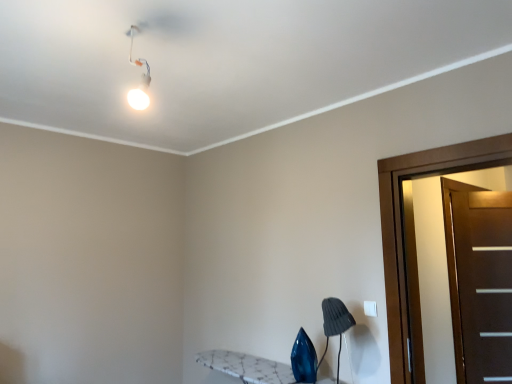
Question: Can you confirm if white glossy light fixture at upper left is wider than gray fabric lampshade at lower right?

Choices:
 (A) yes
 (B) no

Answer: (B)

Question: Can you confirm if white glossy light fixture at upper left is taller than gray fabric lampshade at lower right?

Choices:
 (A) yes
 (B) no

Answer: (B)

Question: Is white glossy light fixture at upper left turned away from gray fabric lampshade at lower right?

Choices:
 (A) no
 (B) yes

Answer: (A)

Question: Can you confirm if white glossy light fixture at upper left is bigger than gray fabric lampshade at lower right?

Choices:
 (A) yes
 (B) no

Answer: (B)

Question: Is white glossy light fixture at upper left to the left of gray fabric lampshade at lower right from the viewer's perspective?

Choices:
 (A) no
 (B) yes

Answer: (B)

Question: Does point (333, 311) appear closer or farther from the camera than point (501, 283)?

Choices:
 (A) closer
 (B) farther

Answer: (A)

Question: Considering the positions of gray fabric lampshade at lower right and brown matte door at right, which is the 1th door from right to left, in the image, is gray fabric lampshade at lower right taller or shorter than brown matte door at right, which is the 1th door from right to left,?

Choices:
 (A) tall
 (B) short

Answer: (B)

Question: From a real-world perspective, is gray fabric lampshade at lower right positioned above or below brown matte door at right, positioned as the second door in front-to-back order?

Choices:
 (A) below
 (B) above

Answer: (A)

Question: Is gray fabric lampshade at lower right in front of or behind brown matte door at right, positioned as the 2th door in left-to-right order, in the image?

Choices:
 (A) behind
 (B) front

Answer: (B)

Question: Is white glossy light fixture at upper left inside or outside of brown matte door at right, positioned as the second door in front-to-back order?

Choices:
 (A) inside
 (B) outside

Answer: (B)

Question: Considering the relative positions of white glossy light fixture at upper left and brown matte door at right, positioned as the 2th door in left-to-right order, in the image provided, is white glossy light fixture at upper left to the left or to the right of brown matte door at right, positioned as the 2th door in left-to-right order,?

Choices:
 (A) left
 (B) right

Answer: (A)

Question: Based on their sizes in the image, would you say white glossy light fixture at upper left is bigger or smaller than brown matte door at right, positioned as the second door in front-to-back order?

Choices:
 (A) small
 (B) big

Answer: (A)

Question: Does point (136, 33) appear closer or farther from the camera than point (503, 324)?

Choices:
 (A) farther
 (B) closer

Answer: (B)

Question: From the image's perspective, is brown matte door at right, which is the 1th door from right to left, positioned above or below gray fabric lampshade at lower right?

Choices:
 (A) above
 (B) below

Answer: (A)

Question: Visually, is brown matte door at right, positioned as the second door in front-to-back order, positioned to the left or to the right of gray fabric lampshade at lower right?

Choices:
 (A) right
 (B) left

Answer: (A)